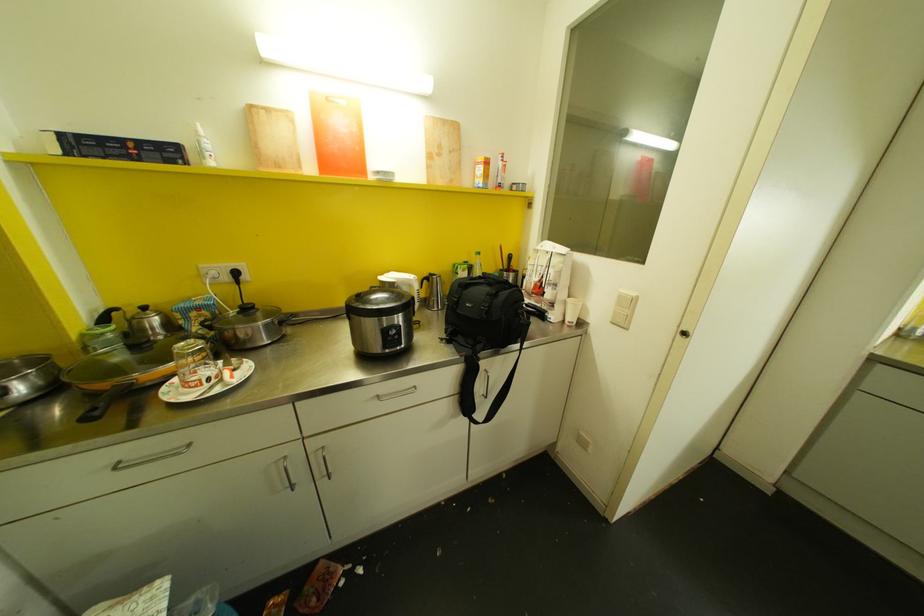
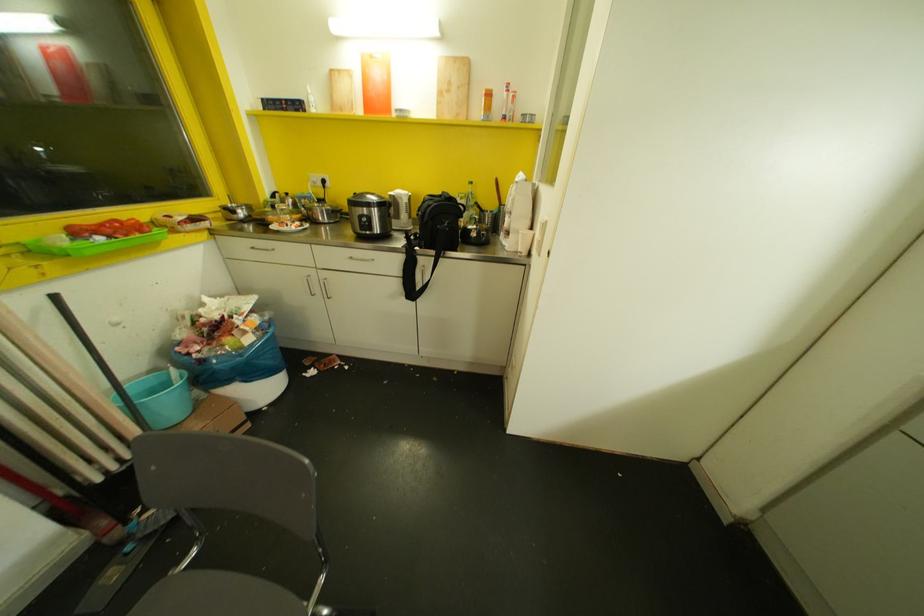
Locate, in the second image, the point that corresponds to [478,253] in the first image.

(469, 182)